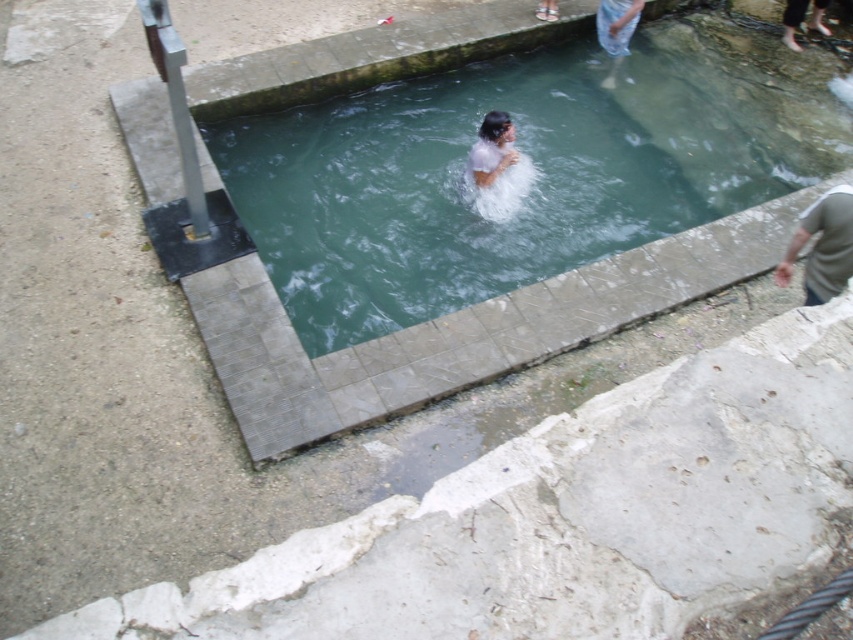
You are a photographer trying to capture the white matte hair at center and the blue denim jeans at upper right in the same frame. Considering their sizes, which object should you focus on first to ensure both are in the frame?

The white matte hair at center has a smaller size compared to the blue denim jeans at upper right. To ensure both are in the frame, focus on the smaller white matte hair at center first to adjust the camera angle, then include the larger blue denim jeans at upper right.

You are standing at the edge of the pool and want to grab the gray cotton shirt at lower right and the blue denim jeans at upper right. Which item can you reach without moving your position?

The gray cotton shirt at lower right is closer to the viewer than the blue denim jeans at upper right, so you can reach the gray cotton shirt at lower right without moving.